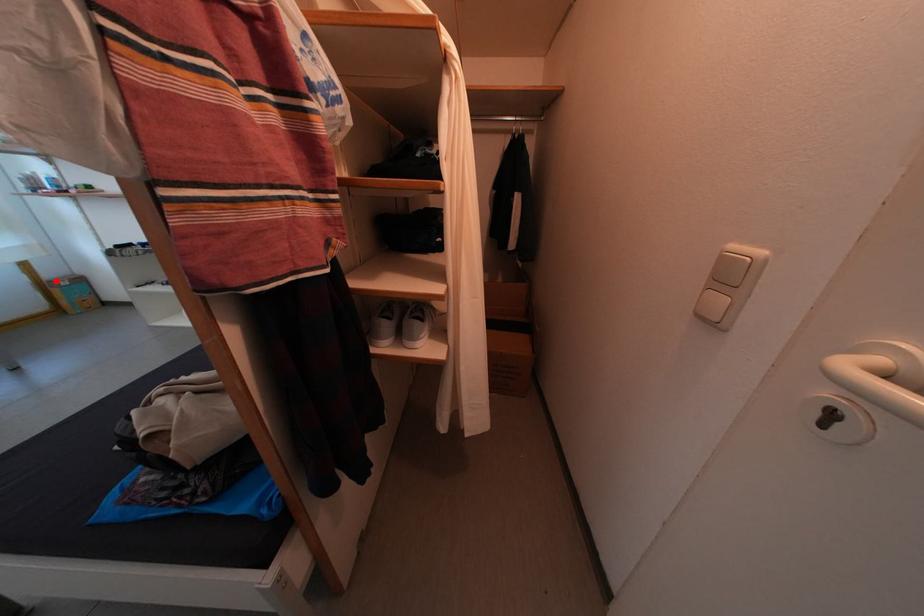
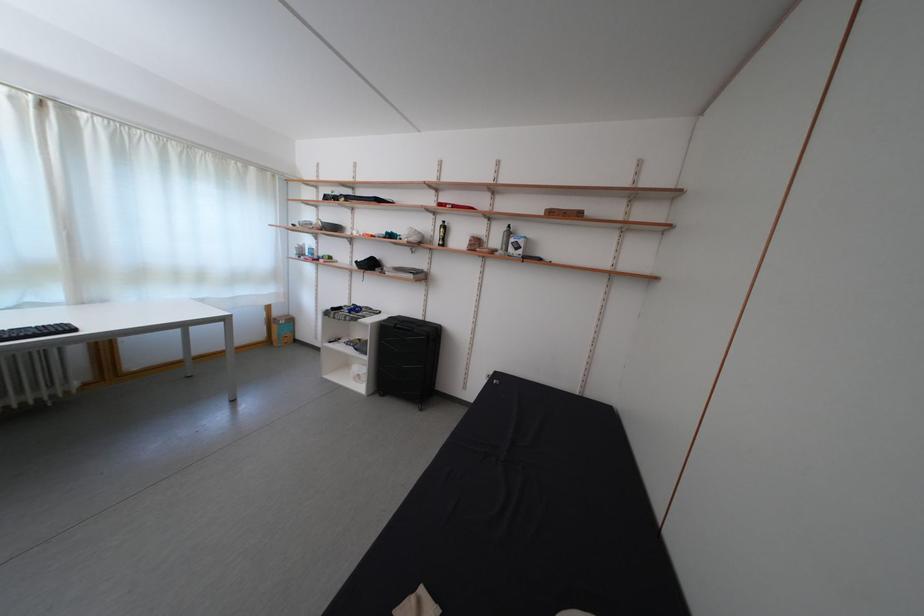
Question: A red point is marked in image1. In image2, is the corresponding 3D point closer to the camera or farther? Reply with the corresponding letter.

Choices:
 (A) The corresponding 3D point is closer.
 (B) The corresponding 3D point is farther.

Answer: (A)